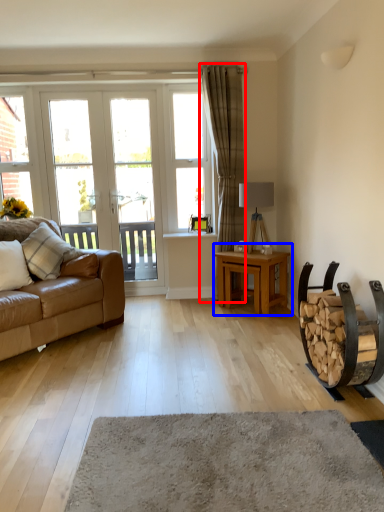
Question: Which point is further to the camera, curtain (highlighted by a red box) or table (highlighted by a blue box)?

Choices:
 (A) curtain
 (B) table

Answer: (A)